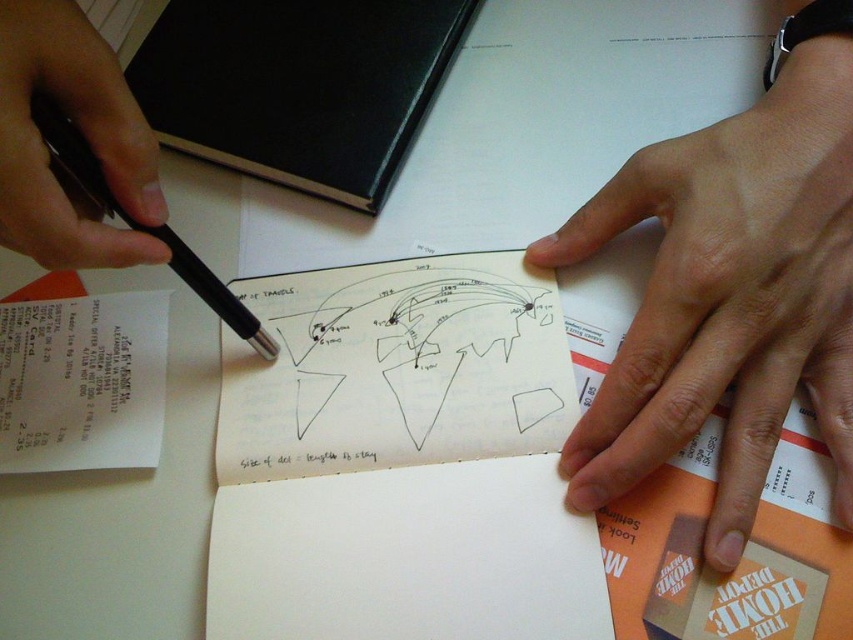
Question: Which of the following is the farthest from the observer?

Choices:
 (A) (204, 288)
 (B) (138, 138)

Answer: (A)

Question: Which of the following is the farthest from the observer?

Choices:
 (A) black metallic pen at left
 (B) smooth skin hand at lower right

Answer: (B)

Question: Is black paper at center positioned in front of black metallic pen at left?

Choices:
 (A) no
 (B) yes

Answer: (A)

Question: Is black paper at center positioned at the back of black metallic pen at left?

Choices:
 (A) yes
 (B) no

Answer: (A)

Question: Based on their relative distances, which object is farther from the black metallic pen at left?

Choices:
 (A) black pen at upper left
 (B) black paper at center
 (C) smooth skin hand at lower right

Answer: (C)

Question: Is smooth skin hand at lower right below black paper at center?

Choices:
 (A) no
 (B) yes

Answer: (A)